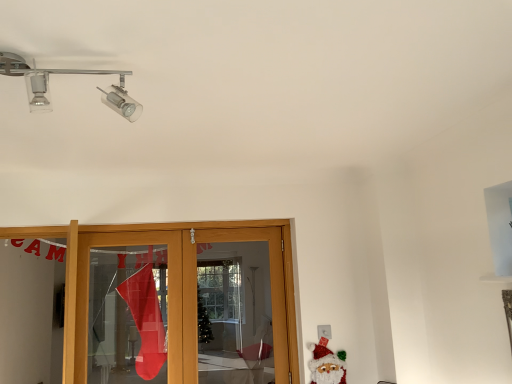
Describe the element at coordinates (326, 364) in the screenshot. I see `felt santa claus at lower right` at that location.

Where is `felt santa claus at lower right`? felt santa claus at lower right is located at coordinates (326, 364).

This screenshot has height=384, width=512. In order to click on chrome/metallic track lighting at upper left in this screenshot , I will do `click(68, 73)`.

What do you see at coordinates (68, 73) in the screenshot? This screenshot has width=512, height=384. I see `chrome/metallic track lighting at upper left` at bounding box center [68, 73].

Identify the location of felt santa claus at lower right. This screenshot has height=384, width=512. (326, 364).

Which is more to the left, felt santa claus at lower right or chrome/metallic track lighting at upper left?

chrome/metallic track lighting at upper left is more to the left.

Relative to chrome/metallic track lighting at upper left, is felt santa claus at lower right in front or behind?

In the image, felt santa claus at lower right appears behind chrome/metallic track lighting at upper left.

Which is closer to the camera, (x=324, y=383) or (x=111, y=91)?

The point (x=111, y=91) is closer to the camera.

From the image's perspective, which one is positioned higher, felt santa claus at lower right or chrome/metallic track lighting at upper left?

chrome/metallic track lighting at upper left, from the image's perspective.

From a real-world perspective, is felt santa claus at lower right above or below chrome/metallic track lighting at upper left?

In terms of real-world spatial position, felt santa claus at lower right is below chrome/metallic track lighting at upper left.

Which of these two, felt santa claus at lower right or chrome/metallic track lighting at upper left, is thinner?

felt santa claus at lower right is thinner.

Considering the relative sizes of felt santa claus at lower right and chrome/metallic track lighting at upper left in the image provided, is felt santa claus at lower right taller than chrome/metallic track lighting at upper left?

Yes, felt santa claus at lower right is taller than chrome/metallic track lighting at upper left.

Considering the sizes of objects felt santa claus at lower right and chrome/metallic track lighting at upper left in the image provided, who is bigger, felt santa claus at lower right or chrome/metallic track lighting at upper left?

chrome/metallic track lighting at upper left is bigger.

Can we say felt santa claus at lower right lies outside chrome/metallic track lighting at upper left?

felt santa claus at lower right is positioned outside chrome/metallic track lighting at upper left.

Is felt santa claus at lower right next to chrome/metallic track lighting at upper left and touching it?

No, felt santa claus at lower right is not making contact with chrome/metallic track lighting at upper left.

Is felt santa claus at lower right facing towards chrome/metallic track lighting at upper left?

No, felt santa claus at lower right is not aimed at chrome/metallic track lighting at upper left.

How far apart are felt santa claus at lower right and chrome/metallic track lighting at upper left?

They are 1.99 meters apart.

Where is `light fixture in front of the felt santa claus at lower right`? Image resolution: width=512 pixels, height=384 pixels. light fixture in front of the felt santa claus at lower right is located at coordinates (68, 73).

Is chrome/metallic track lighting at upper left to the left or to the right of felt santa claus at lower right in the image?

Based on their positions, chrome/metallic track lighting at upper left is located to the left of felt santa claus at lower right.

Is chrome/metallic track lighting at upper left positioned behind felt santa claus at lower right?

No, chrome/metallic track lighting at upper left is closer to the camera.

Does point (22, 74) come in front of point (308, 348)?

Yes, it is.

From the image's perspective, relative to felt santa claus at lower right, is chrome/metallic track lighting at upper left above or below?

Clearly, from the image's perspective, chrome/metallic track lighting at upper left is above felt santa claus at lower right.

From a real-world perspective, is chrome/metallic track lighting at upper left positioned under felt santa claus at lower right based on gravity?

No.

Which object is wider, chrome/metallic track lighting at upper left or felt santa claus at lower right?

Wider between the two is chrome/metallic track lighting at upper left.

Considering the relative sizes of chrome/metallic track lighting at upper left and felt santa claus at lower right in the image provided, is chrome/metallic track lighting at upper left shorter than felt santa claus at lower right?

Yes, chrome/metallic track lighting at upper left is shorter than felt santa claus at lower right.

Considering the relative sizes of chrome/metallic track lighting at upper left and felt santa claus at lower right in the image provided, is chrome/metallic track lighting at upper left bigger than felt santa claus at lower right?

Yes.

Is felt santa claus at lower right located within chrome/metallic track lighting at upper left?

No, felt santa claus at lower right is not a part of chrome/metallic track lighting at upper left.

Is there a large distance between chrome/metallic track lighting at upper left and felt santa claus at lower right?

Indeed, chrome/metallic track lighting at upper left is not near felt santa claus at lower right.

Is felt santa claus at lower right at the back of chrome/metallic track lighting at upper left?

chrome/metallic track lighting at upper left does not have its back to felt santa claus at lower right.

How different are the orientations of chrome/metallic track lighting at upper left and felt santa claus at lower right in degrees?

chrome/metallic track lighting at upper left and felt santa claus at lower right are facing 178 degrees away from each other.

At what (x,y) coordinates should I click in order to perform the action: click on santa claus behind the chrome/metallic track lighting at upper left. Please return your answer as a coordinate pair (x, y). This screenshot has height=384, width=512. Looking at the image, I should click on (326, 364).

This screenshot has width=512, height=384. Find the location of `light fixture on the left of felt santa claus at lower right`. light fixture on the left of felt santa claus at lower right is located at coordinates (68, 73).

The width and height of the screenshot is (512, 384). Find the location of `light fixture positioned vertically above the felt santa claus at lower right (from a real-world perspective)`. light fixture positioned vertically above the felt santa claus at lower right (from a real-world perspective) is located at coordinates (68, 73).